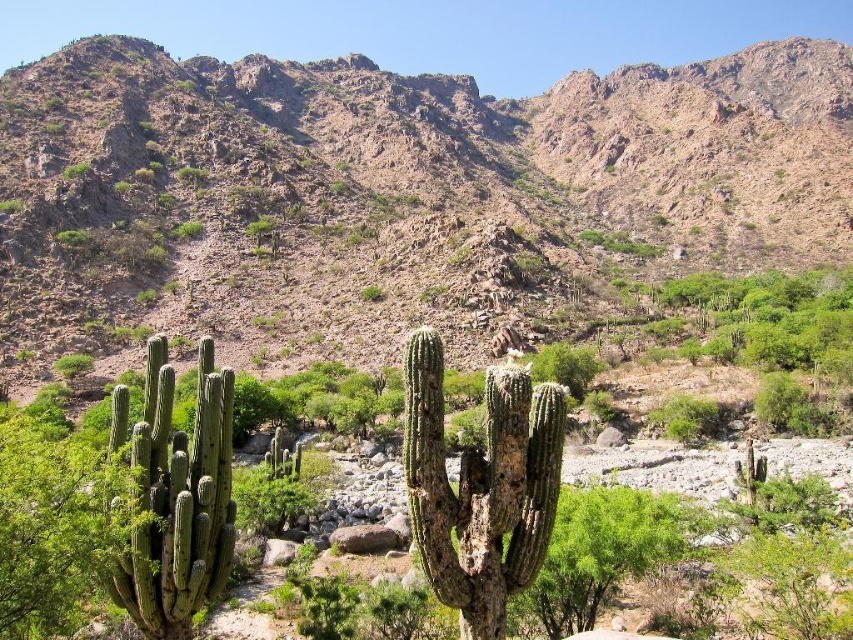
Is point (187, 294) positioned in front of point (408, 397)?

No, (187, 294) is behind (408, 397).

Which is in front, point (451, 321) or point (445, 550)?

Point (445, 550)

Based on the photo, who is more forward, (706, 147) or (469, 452)?

Positioned in front is point (469, 452).

You are a GUI agent. You are given a task and a screenshot of the screen. Output one action in this format:
    pyautogui.click(x=<x>, y=<y>)
    Task: Click on the rugged rock mountain at upper center
    
    Given the screenshot: What is the action you would take?
    pyautogui.click(x=392, y=195)

Image resolution: width=853 pixels, height=640 pixels. Describe the element at coordinates (480, 486) in the screenshot. I see `green rough cactus at center` at that location.

Is green rough cactus at center below green rough cactus at left?

Yes, green rough cactus at center is below green rough cactus at left.

At what (x,y) coordinates should I click in order to perform the action: click on green rough cactus at center. Please return your answer as a coordinate pair (x, y). The image size is (853, 640). Looking at the image, I should click on (480, 486).

At what (x,y) coordinates should I click in order to perform the action: click on green rough cactus at center. Please return your answer as a coordinate pair (x, y). The image size is (853, 640). Looking at the image, I should click on (480, 486).

Who is positioned more to the left, rugged rock mountain at upper center or green rough cactus at left?

green rough cactus at left

Between rugged rock mountain at upper center and green rough cactus at left, which one is positioned higher?

rugged rock mountain at upper center is higher up.

Is point (380, 93) closer to camera compared to point (200, 461)?

No, it is behind (200, 461).

Identify the location of rugged rock mountain at upper center. (392, 195).